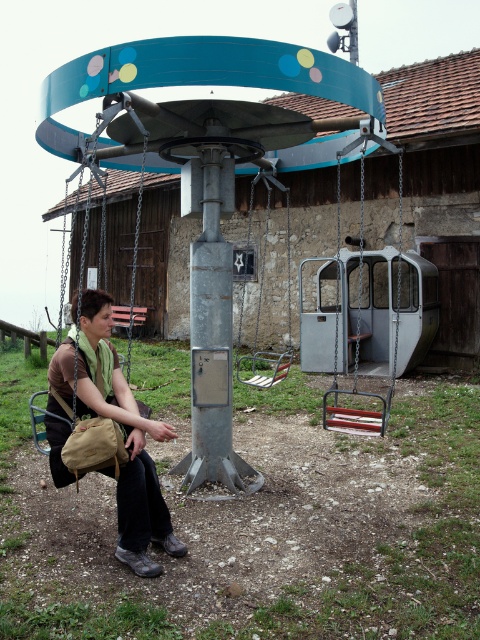
Question: Based on their relative distances, which object is farther from the metallic silver swing at center?

Choices:
 (A) metallic swing at center
 (B) khaki canvas bag at lower left

Answer: (B)

Question: Which point is farther to the camera?

Choices:
 (A) (x=264, y=378)
 (B) (x=108, y=308)

Answer: (A)

Question: Observing the image, what is the correct spatial positioning of khaki canvas bag at lower left in reference to metallic swing at center?

Choices:
 (A) above
 (B) below

Answer: (B)

Question: Is metallic swing at center above metallic silver swing at center?

Choices:
 (A) yes
 (B) no

Answer: (B)

Question: Is khaki canvas bag at lower left in front of metallic swing at center?

Choices:
 (A) no
 (B) yes

Answer: (B)

Question: Which point is closer to the camera?

Choices:
 (A) metallic silver swing at center
 (B) metallic swing at center
 (C) khaki canvas bag at lower left

Answer: (C)